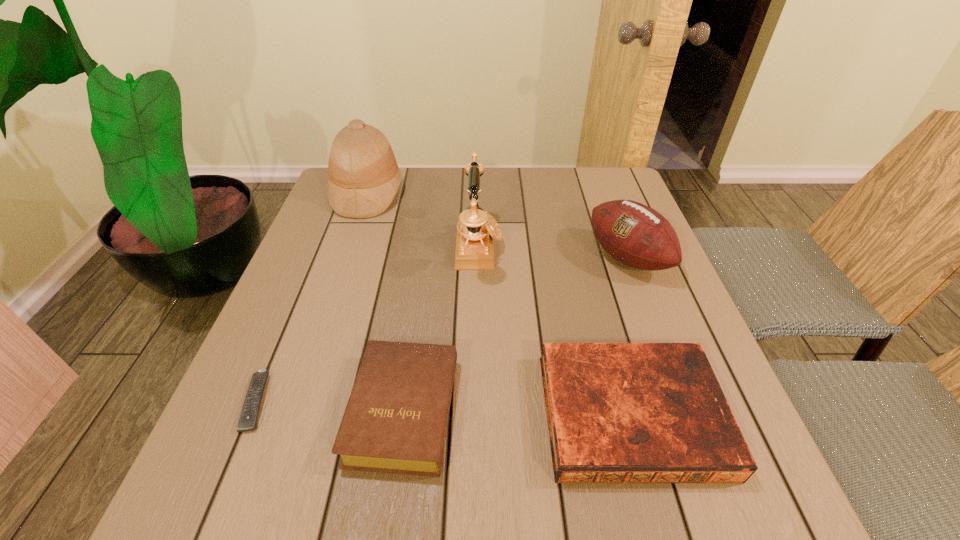
Where is `hat`? Image resolution: width=960 pixels, height=540 pixels. hat is located at coordinates (364, 177).

This screenshot has height=540, width=960. Find the location of `telephone`. telephone is located at coordinates (476, 229).

The image size is (960, 540). I want to click on the third tallest object, so click(634, 234).

Identify the location of the left Bible. The width and height of the screenshot is (960, 540). (395, 421).

You are a GUI agent. You are given a task and a screenshot of the screen. Output one action in this format:
    pyautogui.click(x=<x>, y=<y>)
    Task: Click on the right Bible
    The height and width of the screenshot is (540, 960).
    Given the screenshot: What is the action you would take?
    click(x=617, y=412)

Where is `remote control`? The image size is (960, 540). remote control is located at coordinates point(247,422).

The width and height of the screenshot is (960, 540). I want to click on vacant space situated 0.050m on the front-facing side of the hat, so click(420, 193).

Locate an element on the screen. The width and height of the screenshot is (960, 540). vacant region located on the dial of the telephone is located at coordinates [x=557, y=247].

In order to click on free space located on the back of the third tallest object in this screenshot , I will do `click(610, 210)`.

The height and width of the screenshot is (540, 960). Identify the location of free space located 0.110m on the back of the left Bible. (417, 316).